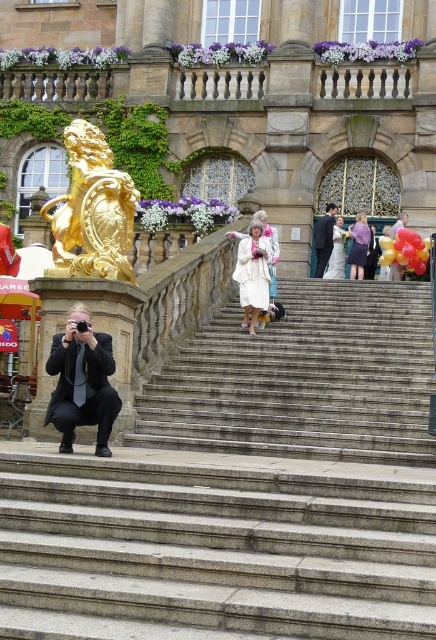
Question: Which object is the closest to the matte gold statue at upper center?

Choices:
 (A) white fur coat at center
 (B) gold polished lion at upper center

Answer: (A)

Question: Among these objects, which one is nearest to the camera?

Choices:
 (A) gold polished lion at upper center
 (B) purple fabric dress at upper center
 (C) dark gray suit at upper center

Answer: (A)

Question: Which of the following is the closest to the observer?

Choices:
 (A) matte gold statue at upper center
 (B) white satin dress at upper center
 (C) white fur coat at center

Answer: (C)

Question: Can you confirm if goldmetalliclion at left is positioned to the right of white fur coat at center?

Choices:
 (A) no
 (B) yes

Answer: (A)

Question: Can you confirm if gray stone stairs at center is positioned below goldmetalliclion at left?

Choices:
 (A) yes
 (B) no

Answer: (A)

Question: Does gold polished lion at upper center have a greater width compared to purple fabric dress at upper center?

Choices:
 (A) yes
 (B) no

Answer: (A)